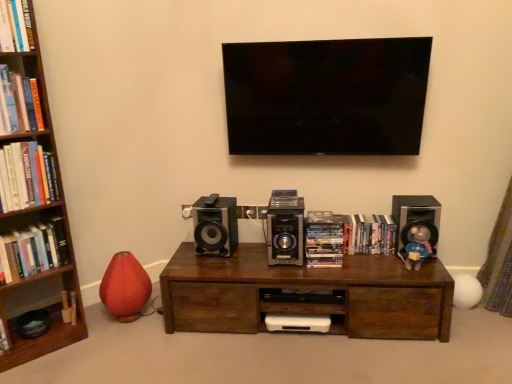
In order to face hardcover books at left, positioned as the fourth book in right-to-left order, should I rotate leftwards or rightwards?

You should rotate left by 28.878 degrees.

In order to face shiny plastic dvds at center, the 2th book viewed from the right, should I rotate leftwards or rightwards?

You should look right and rotate roughly 9.154 degrees.

The width and height of the screenshot is (512, 384). What are the coordinates of `satin black speaker at left, the 3th speaker positioned from the right` in the screenshot? It's located at (215, 225).

What is the approximate width of hardcover books at left, which appears as the 1th book when viewed from the left?

hardcover books at left, which appears as the 1th book when viewed from the left, is 6.69 inches wide.

Locate an element on the screen. hardcover book at upper left, the 4th book when ordered from left to right is located at coordinates (15, 26).

In the scene shown: From a real-world perspective, which is physically below, metallic silver speaker at center, arranged as the second speaker when viewed from the right, or wooden bookcase at left?

From a 3D spatial view, metallic silver speaker at center, arranged as the second speaker when viewed from the right, is below.

From the image's perspective, is metallic silver speaker at center, arranged as the second speaker when viewed from the right, below wooden bookcase at left?

Indeed, from the image's perspective, metallic silver speaker at center, arranged as the second speaker when viewed from the right, is shown beneath wooden bookcase at left.

Would you say metallic silver speaker at center, arranged as the 2th speaker when viewed from the left, is outside wooden bookcase at left?

metallic silver speaker at center, arranged as the 2th speaker when viewed from the left, is positioned outside wooden bookcase at left.

Is metallic silver speaker at center, arranged as the 2th speaker when viewed from the left, to the left of wooden bookcase at left from the viewer's perspective?

No, metallic silver speaker at center, arranged as the 2th speaker when viewed from the left, is not to the left of wooden bookcase at left.

From the image's perspective, is hardcover books at left, which appears as the 1th book when viewed from the left, beneath wooden bookcase at left?

Correct, hardcover books at left, which appears as the 1th book when viewed from the left, appears lower than wooden bookcase at left in the image.

Is hardcover books at left, which appears as the 1th book when viewed from the left, looking in the opposite direction of wooden bookcase at left?

Yes, hardcover books at left, which appears as the 1th book when viewed from the left, is positioned with its back facing wooden bookcase at left.

Between hardcover books at left, which appears as the 6th book when viewed from the right, and wooden bookcase at left, which one has smaller size?

Smaller between the two is hardcover books at left, which appears as the 6th book when viewed from the right.

How far apart are hardcover books at left, which appears as the 6th book when viewed from the right, and wooden bookcase at left?

hardcover books at left, which appears as the 6th book when viewed from the right, and wooden bookcase at left are 5.73 inches apart from each other.

Consider the image. From the image's perspective, would you say hardcover books at left, which appears as the 6th book when viewed from the right, is positioned over hardcover book at left, the second book positioned from the left?

No, from the image's perspective, hardcover books at left, which appears as the 6th book when viewed from the right, is not above hardcover book at left, the second book positioned from the left.

From a real-world perspective, which book is the 2nd one underneath the hardcover book at left, which is the 5th book in right-to-left order? Please provide its 2D coordinates.

[(33, 250)]

From a real-world perspective, does hardcover books at left, which appears as the 1th book when viewed from the left, sit lower than hardcover book at left, which is the 5th book in right-to-left order?

Yes, from a real-world perspective, hardcover books at left, which appears as the 1th book when viewed from the left, is beneath hardcover book at left, which is the 5th book in right-to-left order.

From the image's perspective, is metallic silver speaker at center, arranged as the 2th speaker when viewed from the left, below blue plush toy at right?

No, from the image's perspective, metallic silver speaker at center, arranged as the 2th speaker when viewed from the left, is not below blue plush toy at right.

Can you tell me how much metallic silver speaker at center, arranged as the second speaker when viewed from the right, and blue plush toy at right differ in facing direction?

3.55 degrees separate the facing orientations of metallic silver speaker at center, arranged as the second speaker when viewed from the right, and blue plush toy at right.

Relative to blue plush toy at right, is metallic silver speaker at center, arranged as the 2th speaker when viewed from the left, in front or behind?

metallic silver speaker at center, arranged as the 2th speaker when viewed from the left, is behind blue plush toy at right.

Is metallic silver speaker at center, arranged as the second speaker when viewed from the right, closer to the viewer compared to hardcover book at upper left, the 3th book positioned from the right?

No, it is behind hardcover book at upper left, the 3th book positioned from the right.

Consider the image. From a real-world perspective, is metallic silver speaker at center, arranged as the second speaker when viewed from the right, positioned above or below hardcover book at upper left, the 4th book when ordered from left to right?

Clearly, from a real-world perspective, metallic silver speaker at center, arranged as the second speaker when viewed from the right, is below hardcover book at upper left, the 4th book when ordered from left to right.

This screenshot has width=512, height=384. In order to click on the 3rd book positioned above the metallic silver speaker at center, arranged as the second speaker when viewed from the right (from the image's perspective) in this screenshot , I will do `click(15, 26)`.

Considering the relative sizes of satin black speaker at right, which ranks as the third speaker in left-to-right order, and metallic silver speaker at center, arranged as the 2th speaker when viewed from the left, in the image provided, is satin black speaker at right, which ranks as the third speaker in left-to-right order, shorter than metallic silver speaker at center, arranged as the 2th speaker when viewed from the left,?

No, satin black speaker at right, which ranks as the third speaker in left-to-right order, is not shorter than metallic silver speaker at center, arranged as the 2th speaker when viewed from the left.

Between satin black speaker at right, which ranks as the 1th speaker in right-to-left order, and metallic silver speaker at center, arranged as the 2th speaker when viewed from the left, which one appears on the left side from the viewer's perspective?

Positioned to the left is metallic silver speaker at center, arranged as the 2th speaker when viewed from the left.

Is satin black speaker at right, which ranks as the third speaker in left-to-right order, closer to camera compared to metallic silver speaker at center, arranged as the 2th speaker when viewed from the left?

No, satin black speaker at right, which ranks as the third speaker in left-to-right order, is further to the viewer.

From a real-world perspective, which is physically below, satin black speaker at right, which ranks as the third speaker in left-to-right order, or metallic silver speaker at center, arranged as the second speaker when viewed from the right?

metallic silver speaker at center, arranged as the second speaker when viewed from the right, from a real-world perspective.

In the scene shown: From a real-world perspective, who is located lower, satin black speaker at right, which ranks as the third speaker in left-to-right order, or hardcover book at upper left, the 3th book positioned from the right?

satin black speaker at right, which ranks as the third speaker in left-to-right order, from a real-world perspective.

Is satin black speaker at right, which ranks as the 1th speaker in right-to-left order, shorter than hardcover book at upper left, the 4th book when ordered from left to right?

No, satin black speaker at right, which ranks as the 1th speaker in right-to-left order, is not shorter than hardcover book at upper left, the 4th book when ordered from left to right.

Based on their positions, is satin black speaker at right, which ranks as the third speaker in left-to-right order, located to the left or right of hardcover book at upper left, the 3th book positioned from the right?

satin black speaker at right, which ranks as the third speaker in left-to-right order, is to the right of hardcover book at upper left, the 3th book positioned from the right.

Considering the sizes of objects satin black speaker at right, which ranks as the third speaker in left-to-right order, and hardcover book at upper left, the 3th book positioned from the right, in the image provided, who is wider, satin black speaker at right, which ranks as the third speaker in left-to-right order, or hardcover book at upper left, the 3th book positioned from the right,?

With larger width is hardcover book at upper left, the 3th book positioned from the right.

The height and width of the screenshot is (384, 512). What are the coordinates of `bookcase that appears above the metallic silver speaker at center, arranged as the second speaker when viewed from the right (from the image's perspective)` in the screenshot? It's located at (33, 215).

The width and height of the screenshot is (512, 384). What are the coordinates of `bookcase located on the left of hardcover books at left, which appears as the 1th book when viewed from the left` in the screenshot? It's located at 33,215.

From the image, which object appears to be farther from hardcover book at upper left, the 3th book positioned from the right, hardcover books at left, which appears as the 1th book when viewed from the left, or wooden bookcase at left?

hardcover books at left, which appears as the 1th book when viewed from the left, is positioned further to the anchor hardcover book at upper left, the 3th book positioned from the right.

Based on their spatial positions, is blue plush toy at right or satin black speaker at right, which ranks as the third speaker in left-to-right order, further from wooden bookcase at left?

blue plush toy at right is positioned further to the anchor wooden bookcase at left.

Estimate the real-world distances between objects in this image. Which object is further from wooden bookcase at left, hardcover books at left, which appears as the 6th book when viewed from the right, or blue plush toy at right?

Based on the image, blue plush toy at right appears to be further to wooden bookcase at left.

Which object lies nearer to the anchor point satin black speaker at right, which ranks as the third speaker in left-to-right order, satin black speaker at left, the 3th speaker positioned from the right, or wooden bookcase at left?

satin black speaker at left, the 3th speaker positioned from the right.

Considering their positions, is shiny plastic dvds at center, the 2th book viewed from the right, positioned further to blue plush toy at right than hardcover book at upper left, the 4th book when ordered from left to right?

Among the two, hardcover book at upper left, the 4th book when ordered from left to right, is located further to blue plush toy at right.

From the image, which object appears to be nearer to satin black speaker at left, which ranks as the first speaker in left-to-right order, metallic silver speaker at center, arranged as the second speaker when viewed from the right, or wooden bookcase at left?

Among the two, metallic silver speaker at center, arranged as the second speaker when viewed from the right, is located nearer to satin black speaker at left, which ranks as the first speaker in left-to-right order.

Looking at the image, which one is located further to satin black speaker at right, which ranks as the 1th speaker in right-to-left order, wooden bookcase at left or satin black speaker at left, the 3th speaker positioned from the right?

wooden bookcase at left is further to satin black speaker at right, which ranks as the 1th speaker in right-to-left order.

When comparing their distances from blue plush toy at right, does brown wood table at center or hardcover books at center, which appears as the 6th book when viewed from the left, seem closer?

Based on the image, hardcover books at center, which appears as the 6th book when viewed from the left, appears to be nearer to blue plush toy at right.

Identify the location of table between wooden bookcase at left and hardcover books at center, which appears as the 6th book when viewed from the left, in the horizontal direction. The height and width of the screenshot is (384, 512). (306, 295).

The image size is (512, 384). I want to click on book between hardcover books at left, positioned as the fourth book in right-to-left order, and satin black speaker at left, the 3th speaker positioned from the right, in the horizontal direction, so click(15, 26).

You are a GUI agent. You are given a task and a screenshot of the screen. Output one action in this format:
    pyautogui.click(x=<x>, y=<y>)
    Task: Click on the table between hardcover book at left, which is the 5th book in right-to-left order, and hardcover books at center, which appears as the 6th book when viewed from the left
    
    Given the screenshot: What is the action you would take?
    pyautogui.click(x=306, y=295)

Where is `toy situated between wooden bookcase at left and satin black speaker at right, which ranks as the third speaker in left-to-right order, from left to right`? Image resolution: width=512 pixels, height=384 pixels. toy situated between wooden bookcase at left and satin black speaker at right, which ranks as the third speaker in left-to-right order, from left to right is located at coordinates [x=417, y=247].